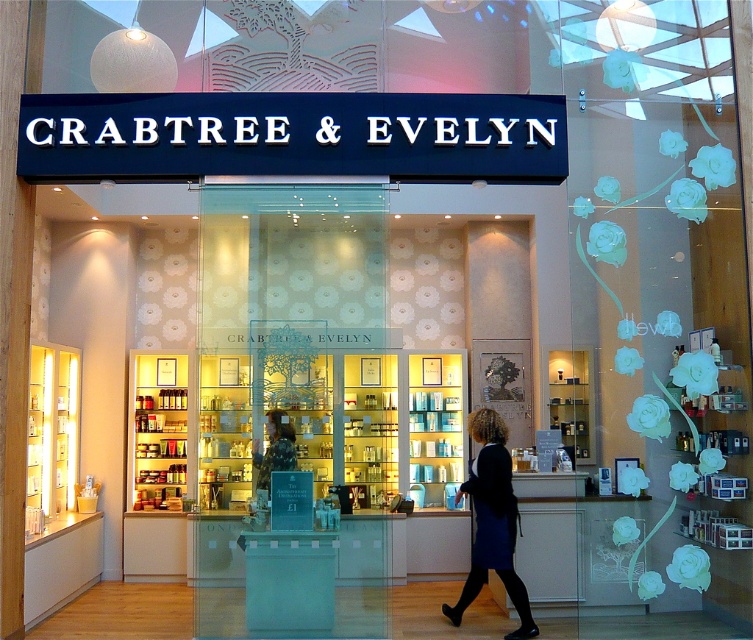
Which of these two, dark blue dress at center or matte black statue at center, stands shorter?

Standing shorter between the two is matte black statue at center.

Does point (508, 547) lie in front of point (255, 461)?

No, it is not.

Which is behind, point (474, 577) or point (273, 429)?

Positioned behind is point (474, 577).

This screenshot has height=640, width=753. Identify the location of dark blue dress at center. (491, 522).